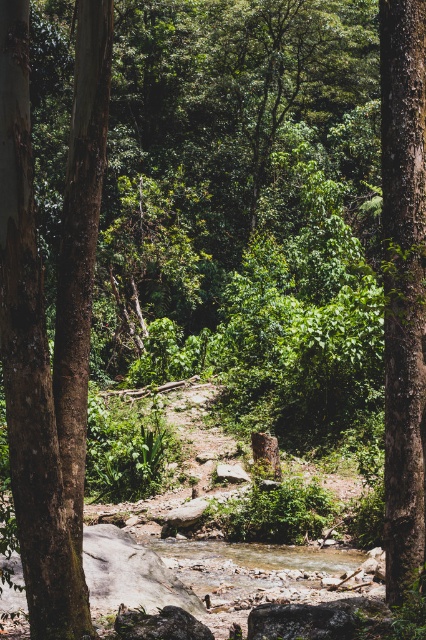
Is brown rough bark tree at left positioned at the back of smooth brown tree trunk at right?

No, it is in front of smooth brown tree trunk at right.

Can you confirm if brown rough bark tree at left is positioned below smooth brown tree trunk at right?

Correct, brown rough bark tree at left is located below smooth brown tree trunk at right.

The height and width of the screenshot is (640, 426). I want to click on brown rough bark tree at left, so click(x=55, y=320).

Image resolution: width=426 pixels, height=640 pixels. I want to click on brown rough bark tree at left, so click(55, 320).